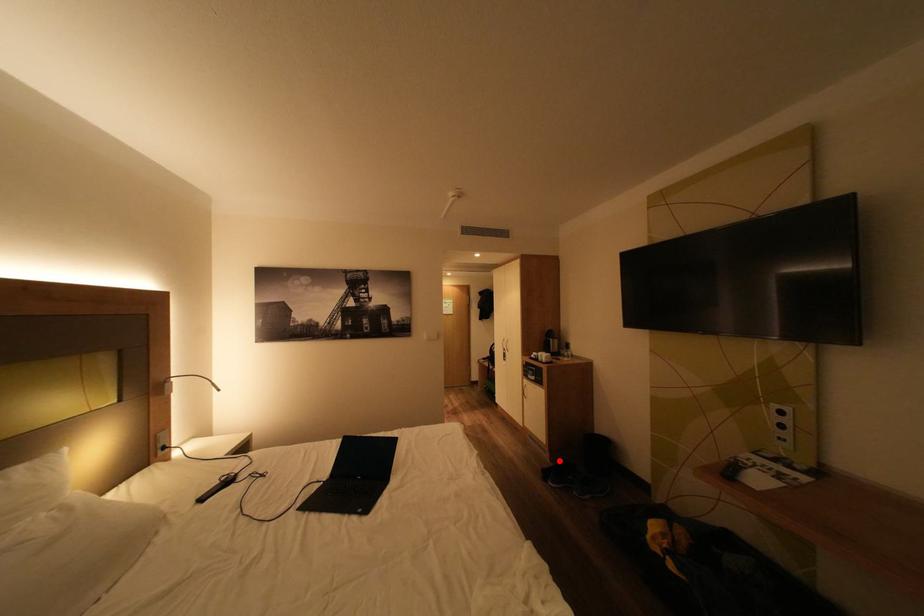
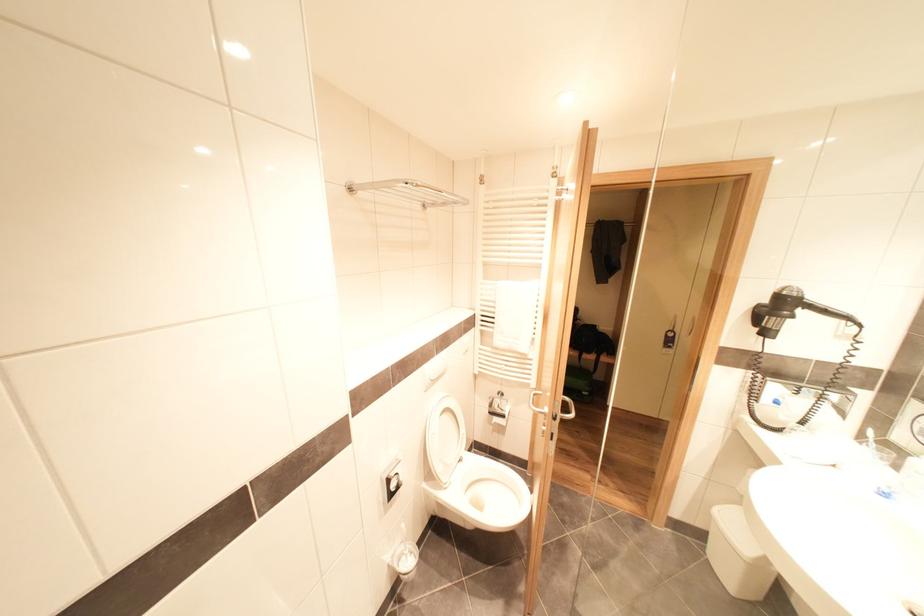
Question: I am providing you with two images of the same scene from different viewpoints. A red point is marked on the first image. Is the red point's position out of view in image 2?

Choices:
 (A) Yes
 (B) No

Answer: (A)